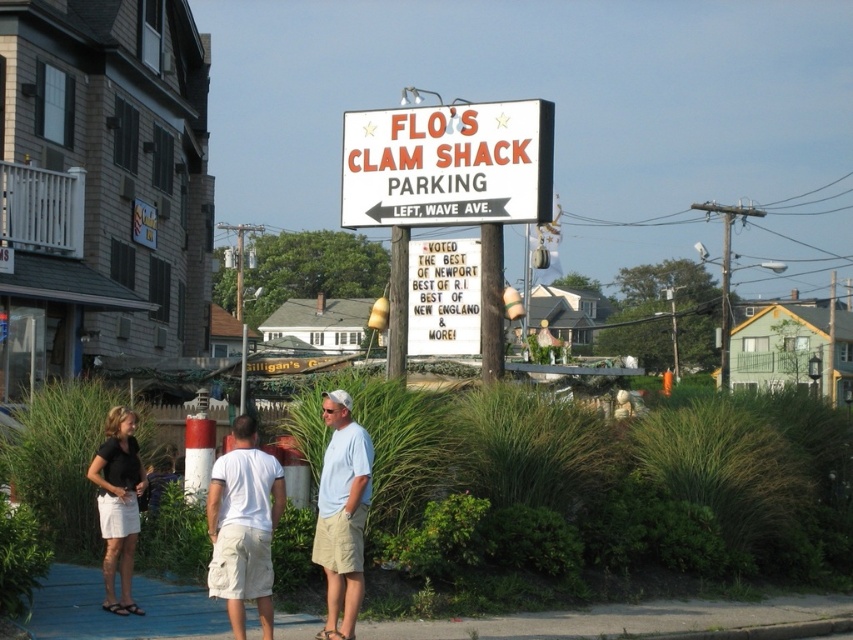
Question: Which point is closer to the camera?

Choices:
 (A) click(219, 618)
 (B) click(526, 179)

Answer: (A)

Question: Which object is positioned farthest from the white cotton t-shirt at center?

Choices:
 (A) light beige shorts at center
 (B) white cotton shirt at center
 (C) white plastic sign at upper center

Answer: (C)

Question: Which of the following is the closest to the observer?

Choices:
 (A) white cotton t-shirt at center
 (B) blue concrete pavement at lower center
 (C) white cotton shirt at center

Answer: (A)

Question: Is white cotton shirt at center behind light beige shorts at center?

Choices:
 (A) yes
 (B) no

Answer: (A)

Question: Observing the image, what is the correct spatial positioning of white plastic sign at upper center in reference to white cotton t-shirt at center?

Choices:
 (A) below
 (B) above

Answer: (B)

Question: Does white plastic sign at upper center appear on the left side of white cotton shirt at center?

Choices:
 (A) no
 (B) yes

Answer: (A)